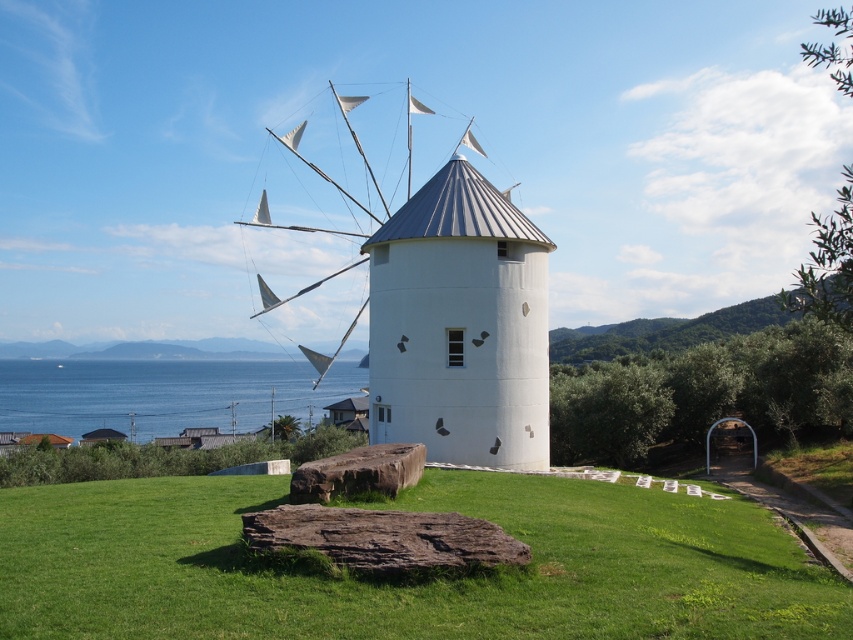
Between green grass at center and blue water at lower left, which one has more height?

blue water at lower left is taller.

Which is above, green grass at center or blue water at lower left?

green grass at center is above.

Between point (164, 611) and point (361, 371), which one is positioned in front?

Point (164, 611) is in front.

The height and width of the screenshot is (640, 853). Identify the location of green grass at center. (407, 579).

Can you confirm if green grass at center is taller than white matte windmill at center?

Incorrect, green grass at center's height is not larger of white matte windmill at center's.

Is green grass at center behind white matte windmill at center?

No.

You are a GUI agent. You are given a task and a screenshot of the screen. Output one action in this format:
    pyautogui.click(x=<x>, y=<y>)
    Task: Click on the green grass at center
    The width and height of the screenshot is (853, 640).
    Given the screenshot: What is the action you would take?
    pyautogui.click(x=407, y=579)

Is point (543, 388) closer to viewer compared to point (154, 369)?

Yes, it is.

Is white matte windmill at center positioned in front of blue water at lower left?

Yes, it is.

Who is more forward, [457,348] or [299,406]?

Positioned in front is point [457,348].

The image size is (853, 640). Identify the location of white matte windmill at center. (459, 324).